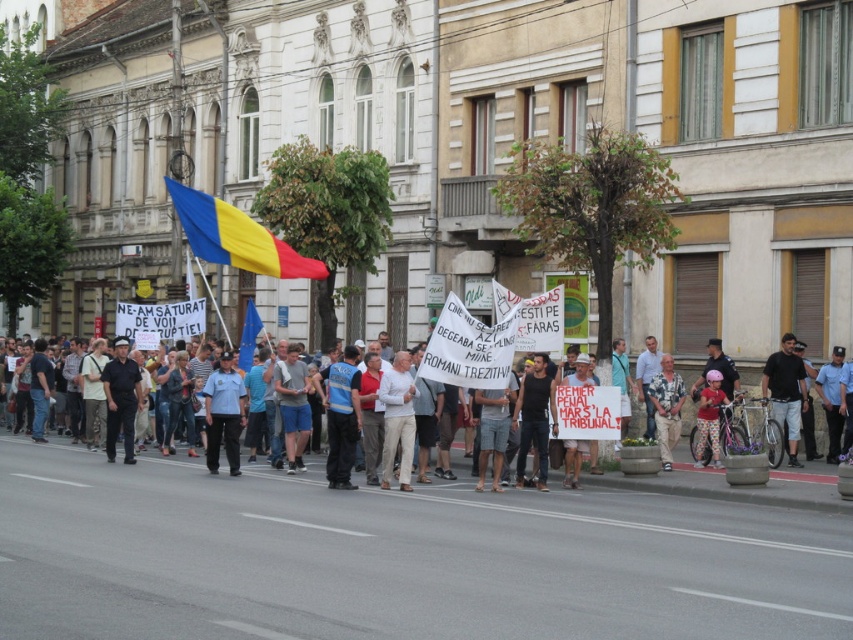
Question: Is the position of blue uniform at center less distant than that of light brown shirt at center?

Choices:
 (A) yes
 (B) no

Answer: (A)

Question: From the image, what is the correct spatial relationship of polka dot pants at lower right in relation to blue fabric flag at center?

Choices:
 (A) right
 (B) left

Answer: (A)

Question: Which of the following is the farthest from the observer?

Choices:
 (A) polka dot pants at lower right
 (B) blue fabric flag at center
 (C) light brown shirt at center

Answer: (B)

Question: Which object is positioned farthest from the blue fabric flag at center?

Choices:
 (A) light brown shirt at center
 (B) black cotton shirt at right
 (C) blue/yellow fabric flag at upper center
 (D) light blue uniform at center

Answer: (B)

Question: Which of the following is the farthest from the observer?

Choices:
 (A) (714, 413)
 (B) (793, 408)

Answer: (B)

Question: Can you confirm if light blue uniform at center is positioned below blue uniform at center?

Choices:
 (A) yes
 (B) no

Answer: (A)